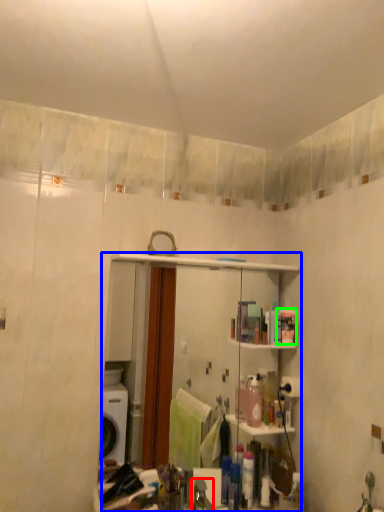
Question: Which is farther away from faucet (highlighted by a red box)? mirror (highlighted by a blue box) or toiletry (highlighted by a green box)?

Choices:
 (A) mirror
 (B) toiletry

Answer: (A)